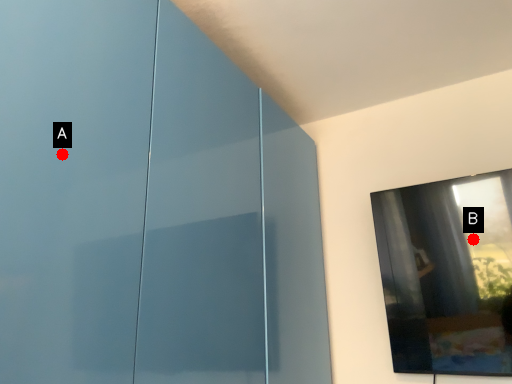
Question: Two points are circled on the image, labeled by A and B beside each circle. Which point is farther to the camera?

Choices:
 (A) A is further
 (B) B is further

Answer: (B)